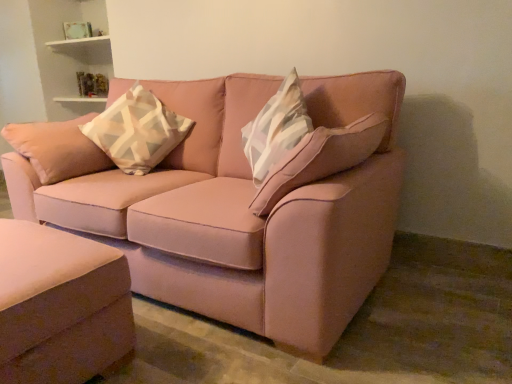
Question: Does point (347, 119) appear closer or farther from the camera than point (97, 304)?

Choices:
 (A) farther
 (B) closer

Answer: (A)

Question: In the image, is matte pink fabric couch at center, which is counted as the 2th studio couch, starting from the bottom, positioned in front of or behind satin pink ottoman at lower left, which ranks as the 1th studio couch in bottom-to-top order?

Choices:
 (A) behind
 (B) front

Answer: (A)

Question: Which object is the farthest from the satin pink ottoman at lower left, which ranks as the 1th studio couch in bottom-to-top order?

Choices:
 (A) white and gray geometric-patterned pillow at upper left
 (B) matte pink fabric couch at center, which is counted as the 1th studio couch, starting from the top

Answer: (A)

Question: Based on their relative distances, which object is farther from the matte pink fabric couch at center, which is counted as the 1th studio couch, starting from the top?

Choices:
 (A) white and gray geometric-patterned pillow at upper left
 (B) satin pink ottoman at lower left, positioned as the 2th studio couch in top-to-bottom order

Answer: (B)